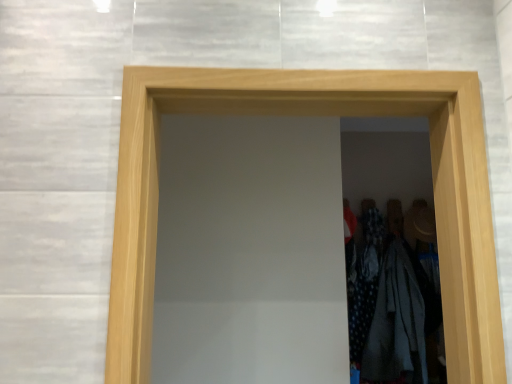
Question: Is white cotton shirt at right located outside natural wood door at center?

Choices:
 (A) no
 (B) yes

Answer: (B)

Question: Is white cotton shirt at right at the right side of natural wood door at center?

Choices:
 (A) no
 (B) yes

Answer: (B)

Question: From a real-world perspective, is white cotton shirt at right below natural wood door at center?

Choices:
 (A) yes
 (B) no

Answer: (A)

Question: Considering the relative sizes of white cotton shirt at right and natural wood door at center in the image provided, is white cotton shirt at right wider than natural wood door at center?

Choices:
 (A) yes
 (B) no

Answer: (B)

Question: Does white cotton shirt at right come in front of natural wood door at center?

Choices:
 (A) yes
 (B) no

Answer: (B)

Question: Does white cotton shirt at right have a greater height compared to natural wood door at center?

Choices:
 (A) yes
 (B) no

Answer: (A)

Question: Does natural wood door at center appear on the left side of white cotton shirt at right?

Choices:
 (A) yes
 (B) no

Answer: (A)

Question: Is natural wood door at center shorter than white cotton shirt at right?

Choices:
 (A) no
 (B) yes

Answer: (B)

Question: Is the position of natural wood door at center less distant than that of white cotton shirt at right?

Choices:
 (A) yes
 (B) no

Answer: (A)

Question: Is white cotton shirt at right surrounded by natural wood door at center?

Choices:
 (A) no
 (B) yes

Answer: (A)

Question: Considering the relative positions of natural wood door at center and white cotton shirt at right in the image provided, is natural wood door at center to the right of white cotton shirt at right from the viewer's perspective?

Choices:
 (A) yes
 (B) no

Answer: (B)

Question: From a real-world perspective, does natural wood door at center stand above white cotton shirt at right?

Choices:
 (A) no
 (B) yes

Answer: (B)

Question: Does polka dot fabric dress at right have a greater width compared to natural wood door at center?

Choices:
 (A) no
 (B) yes

Answer: (A)